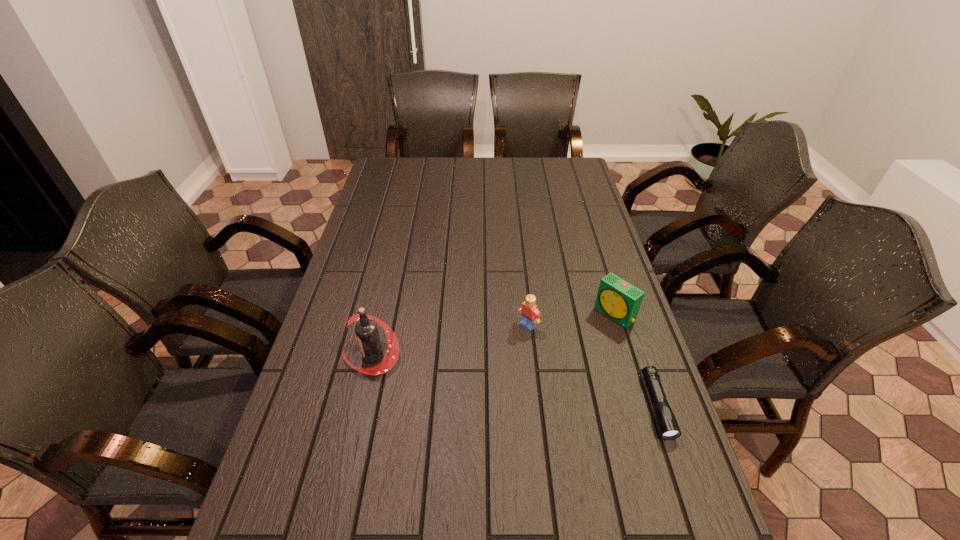
Locate an element on the screen. This screenshot has width=960, height=540. the tallest object is located at coordinates click(366, 330).

I want to click on the leftmost object, so (x=366, y=330).

Locate an element on the screen. flashlight is located at coordinates (669, 429).

Find the location of a particular element. alarm clock is located at coordinates (618, 299).

Find the location of a particular element. The image size is (960, 540). the second object from left to right is located at coordinates (530, 314).

Find the location of a particular element. vacant space located 0.060m on the label of the tallest object is located at coordinates (321, 355).

You are a GUI agent. You are given a task and a screenshot of the screen. Output one action in this format:
    pyautogui.click(x=<x>, y=<y>)
    Task: Click on the free point located at the lens end of the flashlight
    The image size is (960, 540).
    Given the screenshot: What is the action you would take?
    coord(686,495)

Locate an element on the screen. The width and height of the screenshot is (960, 540). free location located on the front-facing side of the alarm clock is located at coordinates (522, 388).

Locate an element on the screen. The width and height of the screenshot is (960, 540). vacant space situated 0.080m on the front-facing side of the alarm clock is located at coordinates (586, 338).

Locate an element on the screen. The image size is (960, 540). blank space located 0.380m on the front-facing side of the alarm clock is located at coordinates (508, 400).